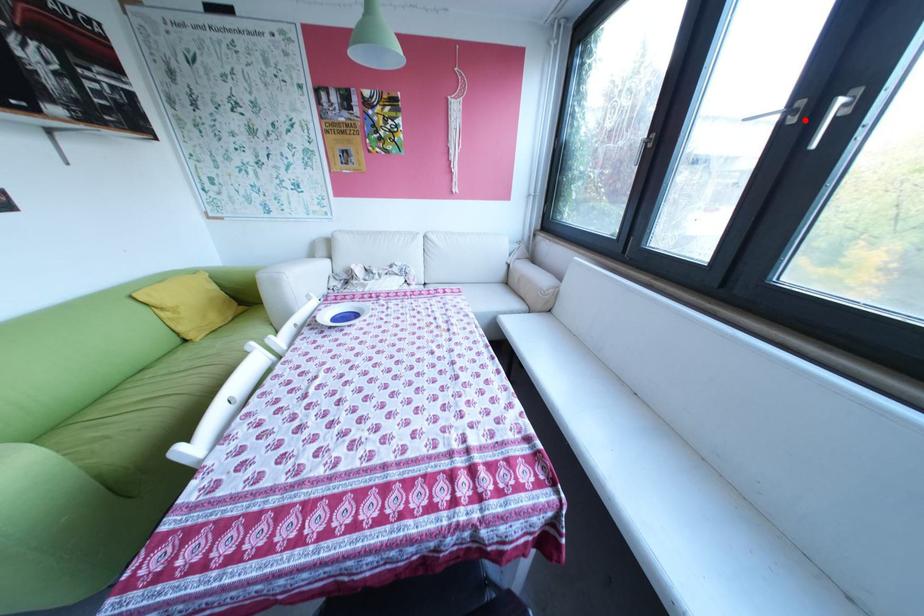
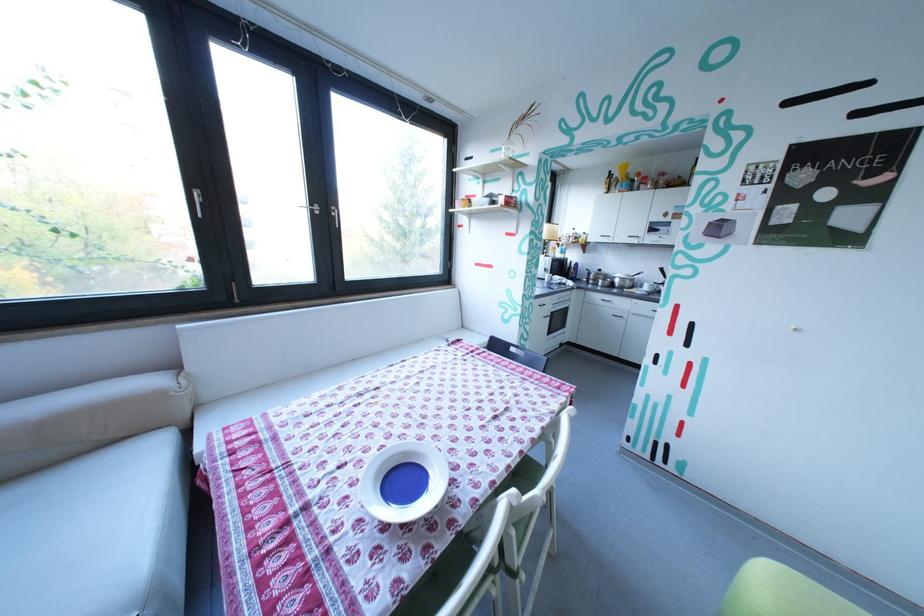
Question: I am providing you with two images of the same scene from different viewpoints. Image1 has a red point marked. In image2, the corresponding 3D location appears at what relative position? Reply with the corresponding letter.

Choices:
 (A) Closer
 (B) Farther

Answer: (A)